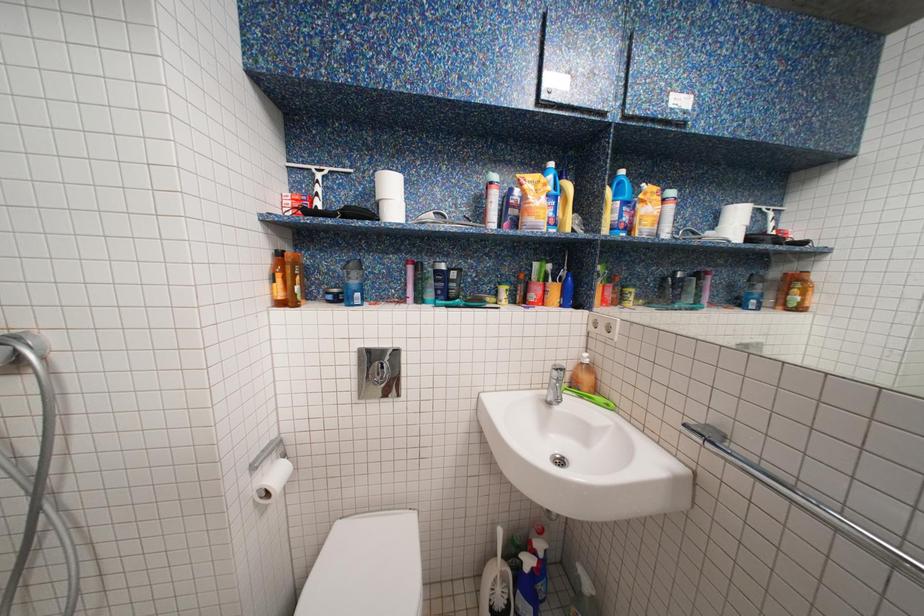
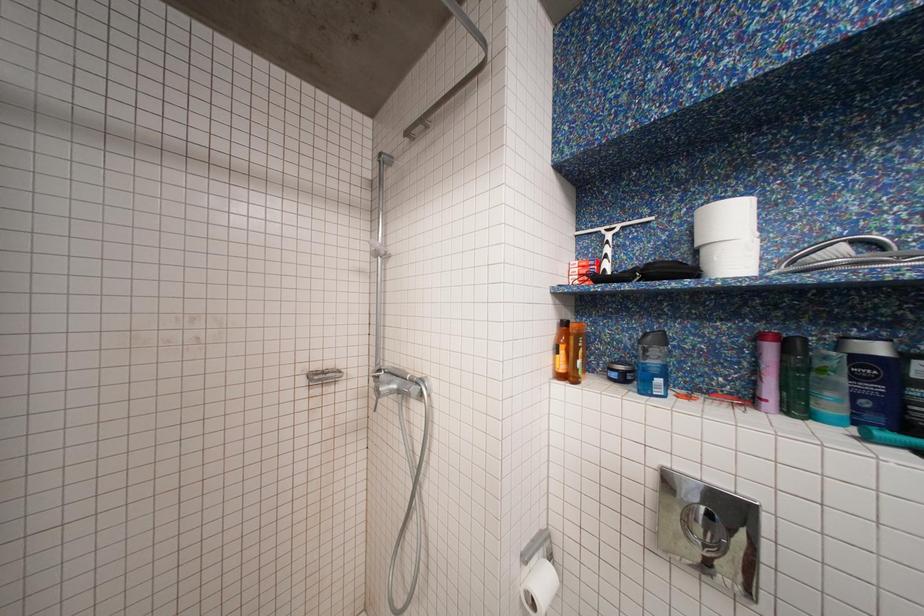
Question: Based on the continuous images, in which direction is the camera rotating? Reply with the corresponding letter.

Choices:
 (A) Left
 (B) Right
 (C) Up
 (D) Down

Answer: (A)